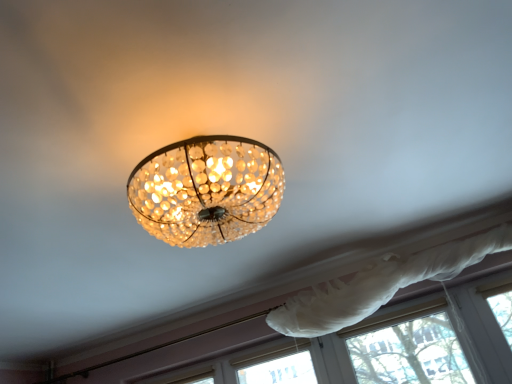
Question: Can you confirm if white sheer curtain at upper center is shorter than white sheer curtain at lower right?

Choices:
 (A) yes
 (B) no

Answer: (B)

Question: Is white sheer curtain at upper center looking in the opposite direction of white sheer curtain at lower right?

Choices:
 (A) yes
 (B) no

Answer: (A)

Question: Is white sheer curtain at upper center bigger than white sheer curtain at lower right?

Choices:
 (A) yes
 (B) no

Answer: (A)

Question: From the image's perspective, is white sheer curtain at upper center below white sheer curtain at lower right?

Choices:
 (A) yes
 (B) no

Answer: (B)

Question: Is the position of white sheer curtain at upper center less distant than that of white sheer curtain at lower right?

Choices:
 (A) no
 (B) yes

Answer: (B)

Question: Could white sheer curtain at lower right be considered to be inside white sheer curtain at upper center?

Choices:
 (A) yes
 (B) no

Answer: (B)

Question: From the image's perspective, is white sheer curtain at lower right located beneath white sheer curtain at upper center?

Choices:
 (A) yes
 (B) no

Answer: (A)

Question: Is white sheer curtain at lower right in front of white sheer curtain at upper center?

Choices:
 (A) no
 (B) yes

Answer: (A)

Question: From the image's perspective, is white sheer curtain at lower right above white sheer curtain at upper center?

Choices:
 (A) yes
 (B) no

Answer: (B)

Question: Does white sheer curtain at lower right have a lesser height compared to white sheer curtain at upper center?

Choices:
 (A) yes
 (B) no

Answer: (A)

Question: Is white sheer curtain at lower right to the left of white sheer curtain at upper center from the viewer's perspective?

Choices:
 (A) no
 (B) yes

Answer: (B)

Question: Does white sheer curtain at lower right appear on the right side of white sheer curtain at upper center?

Choices:
 (A) yes
 (B) no

Answer: (B)

Question: Is white sheer curtain at lower right spatially inside white sheer curtain at upper center, or outside of it?

Choices:
 (A) inside
 (B) outside

Answer: (B)